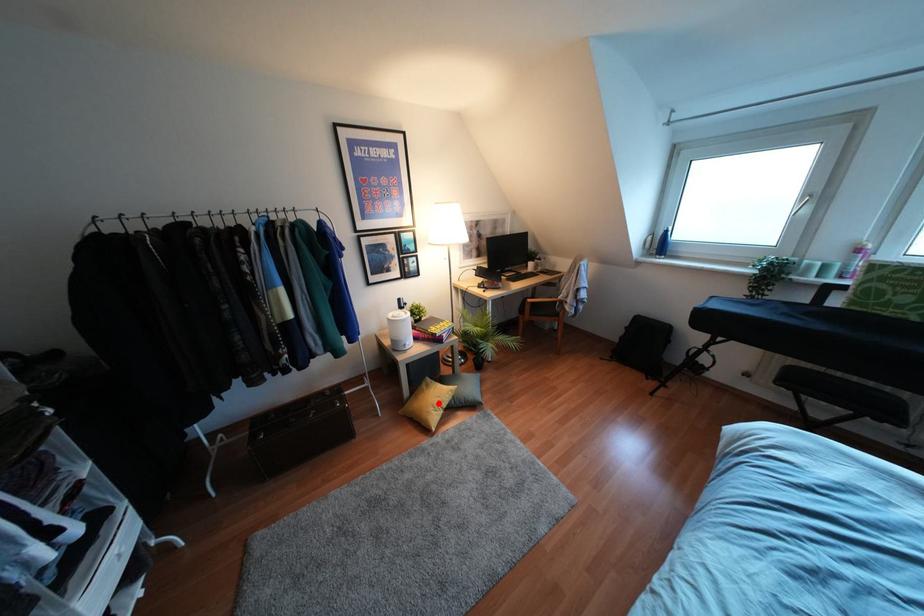
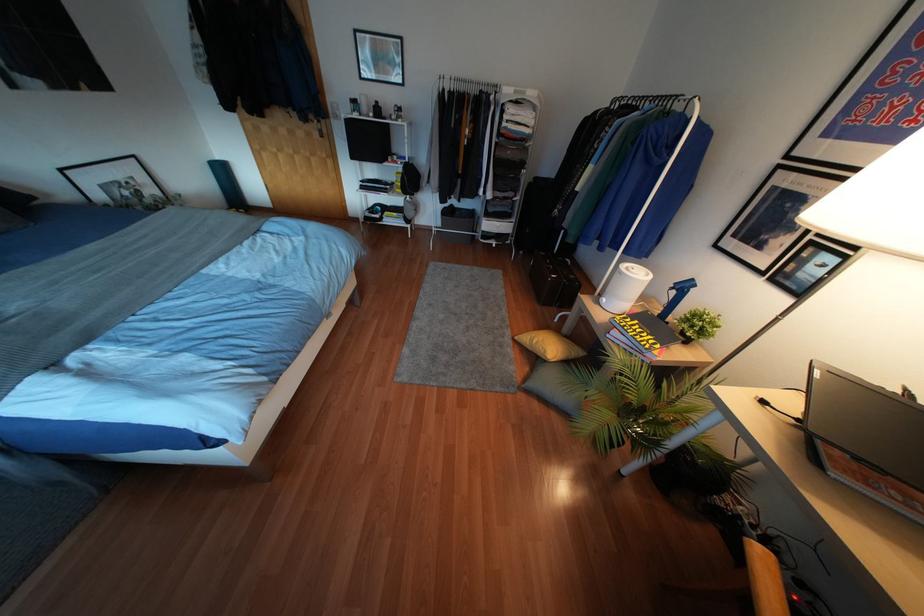
Question: I am providing you with two images of the same scene from different viewpoints. A red point is shown in image1. For the corresponding object point in image2, is it positioned nearer or farther from the camera?

Choices:
 (A) Nearer
 (B) Farther

Answer: (A)